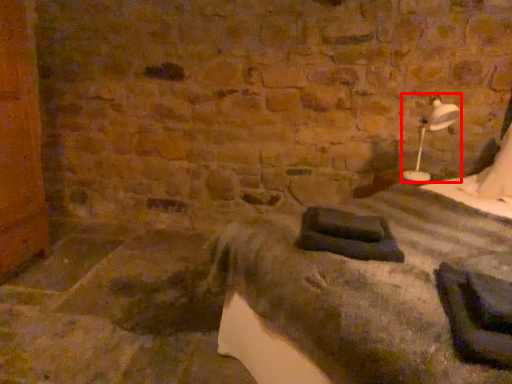
Question: Considering the relative positions of bedside lamp (annotated by the red box) and bed in the image provided, where is bedside lamp (annotated by the red box) located with respect to the staircase?

Choices:
 (A) right
 (B) left

Answer: (A)